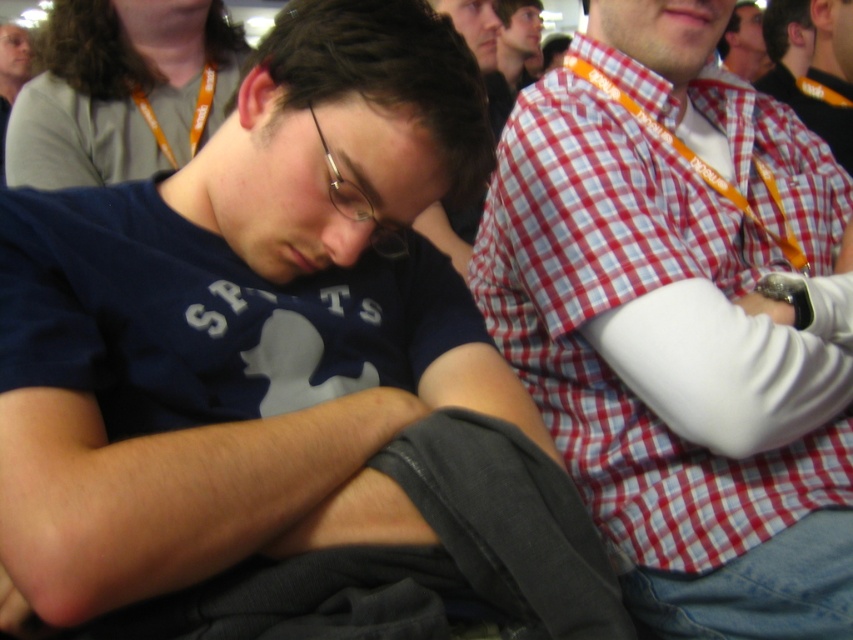
Between gray fabric shirt at upper left and checkered fabric shirt at upper right, which one has more height?

checkered fabric shirt at upper right

Describe the element at coordinates (120, 90) in the screenshot. I see `gray fabric shirt at upper left` at that location.

This screenshot has height=640, width=853. What are the coordinates of `gray fabric shirt at upper left` in the screenshot? It's located at [120, 90].

Does matte blue shirt at center appear over checkered fabric shirt at upper right?

Actually, matte blue shirt at center is below checkered fabric shirt at upper right.

This screenshot has width=853, height=640. What do you see at coordinates (283, 371) in the screenshot?
I see `matte blue shirt at center` at bounding box center [283, 371].

Where is `matte blue shirt at center`? The width and height of the screenshot is (853, 640). matte blue shirt at center is located at coordinates (x=283, y=371).

The width and height of the screenshot is (853, 640). In order to click on matte blue shirt at center in this screenshot , I will do `click(283, 371)`.

Is red checkered shirt at center positioned behind matte black glasses at upper center?

No, it is not.

How distant is red checkered shirt at center from matte black glasses at upper center?

6.00 feet

Is point (634, 310) less distant than point (525, 81)?

That is True.

The height and width of the screenshot is (640, 853). I want to click on red checkered shirt at center, so click(x=683, y=321).